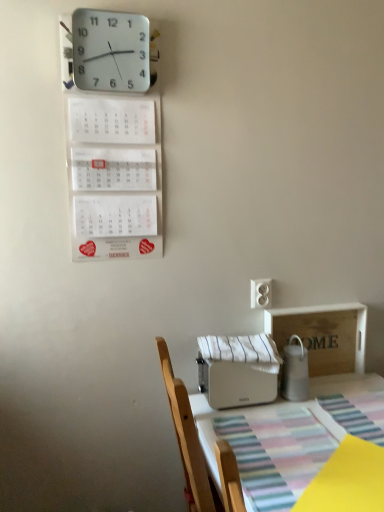
Locate an element on the screen. This screenshot has width=384, height=512. free location to the right of white glossy milk jug at right, placed as the 2th appliance when sorted from left to right is located at coordinates (338, 397).